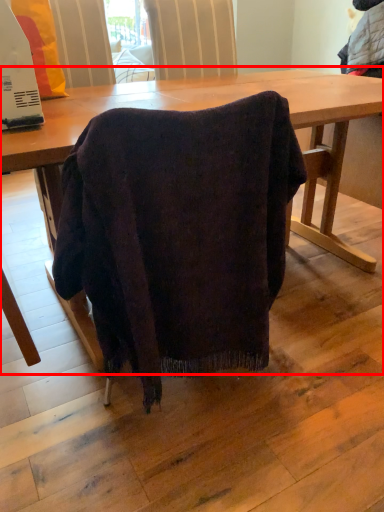
Question: Considering the relative positions of table (annotated by the red box) and appliance in the image provided, where is table (annotated by the red box) located with respect to the staircase?

Choices:
 (A) left
 (B) right

Answer: (B)